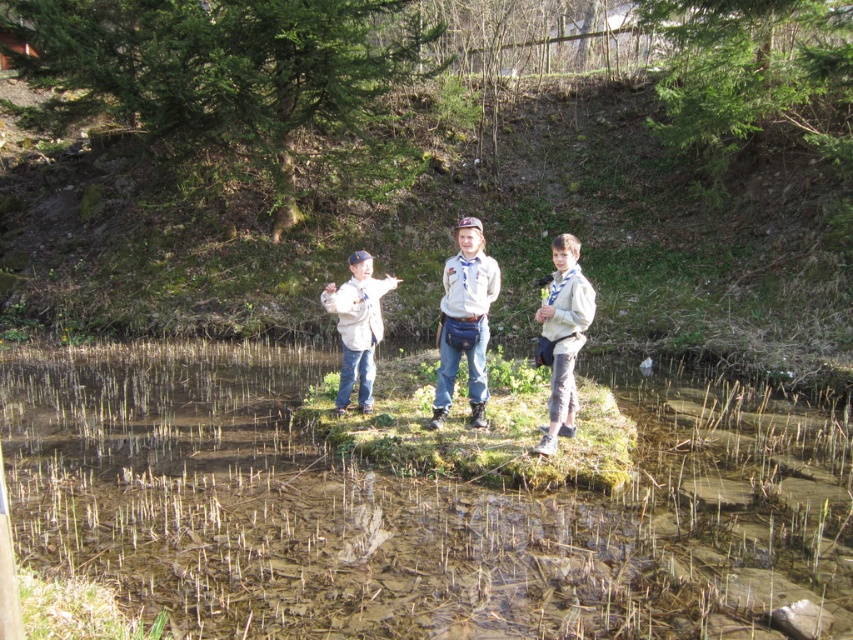
Is light brown uniform at center thinner than light brown denim jacket at center?

No, light brown uniform at center is not thinner than light brown denim jacket at center.

You are a GUI agent. You are given a task and a screenshot of the screen. Output one action in this format:
    pyautogui.click(x=<x>, y=<y>)
    Task: Click on the light brown uniform at center
    The image size is (853, 640).
    Given the screenshot: What is the action you would take?
    pyautogui.click(x=465, y=321)

Image resolution: width=853 pixels, height=640 pixels. In order to click on light brown uniform at center in this screenshot , I will do `click(465, 321)`.

Which is behind, point (196, 394) or point (547, 449)?

Positioned behind is point (196, 394).

Does clear water at center appear on the right side of gray cotton shirt at center?

In fact, clear water at center is to the left of gray cotton shirt at center.

Where is `clear water at center`? Image resolution: width=853 pixels, height=640 pixels. clear water at center is located at coordinates (408, 508).

Locate an element on the screen. The height and width of the screenshot is (640, 853). clear water at center is located at coordinates (408, 508).

Can you confirm if clear water at center is positioned below light brown denim jacket at center?

Yes, clear water at center is below light brown denim jacket at center.

I want to click on clear water at center, so click(x=408, y=508).